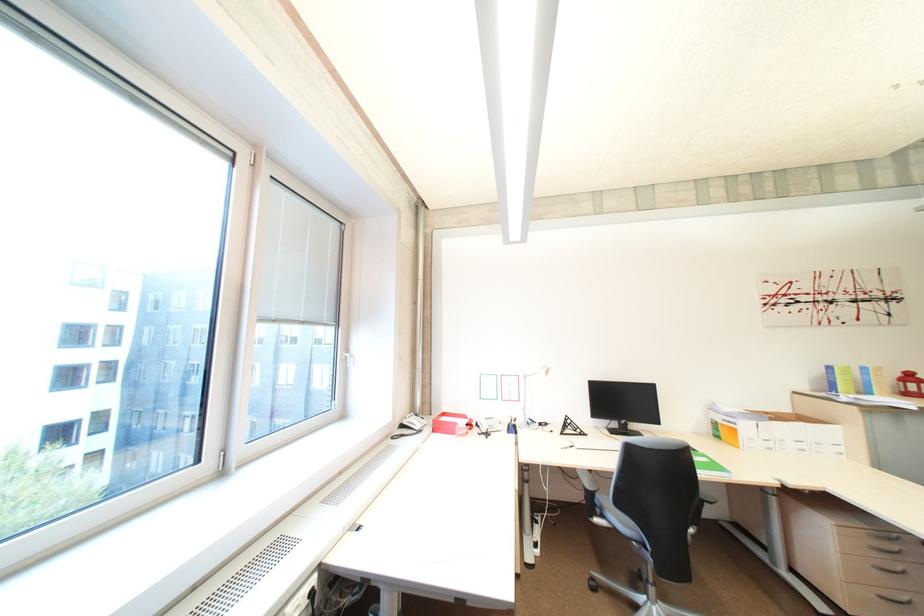
At what (x,y) coordinates should I click in order to perform the action: click on chair sitting surface. Please return your answer as a coordinate pair (x, y). The image size is (924, 616). Looking at the image, I should click on (614, 514).